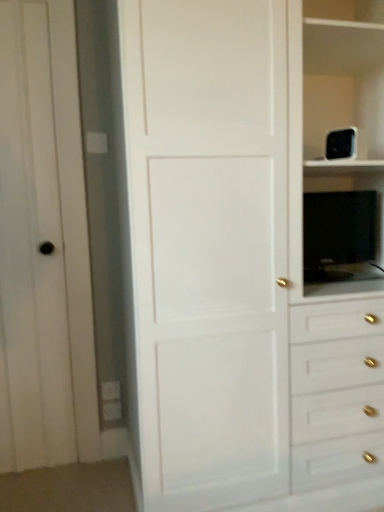
Question: Looking at their shapes, would you say white matte door at center is wider or thinner than white matte door at left?

Choices:
 (A) wide
 (B) thin

Answer: (A)

Question: In terms of height, does white matte door at center look taller or shorter compared to white matte door at left?

Choices:
 (A) tall
 (B) short

Answer: (A)

Question: Which is farther from the white matte door at left?

Choices:
 (A) black glossy tv at right
 (B) white matte door at center

Answer: (A)

Question: Which object is positioned farthest from the white matte door at center?

Choices:
 (A) black glossy tv at right
 (B) white matte door at left

Answer: (B)